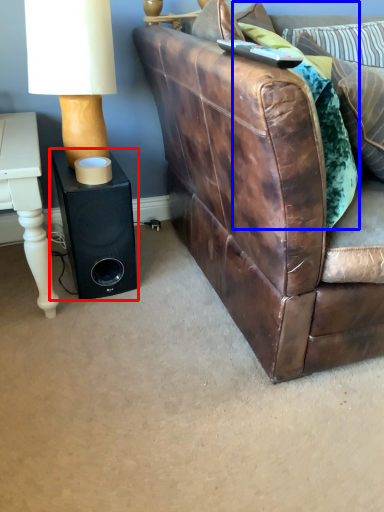
Question: Which point is further to the camera, speaker (highlighted by a red box) or pillow (highlighted by a blue box)?

Choices:
 (A) speaker
 (B) pillow

Answer: (A)